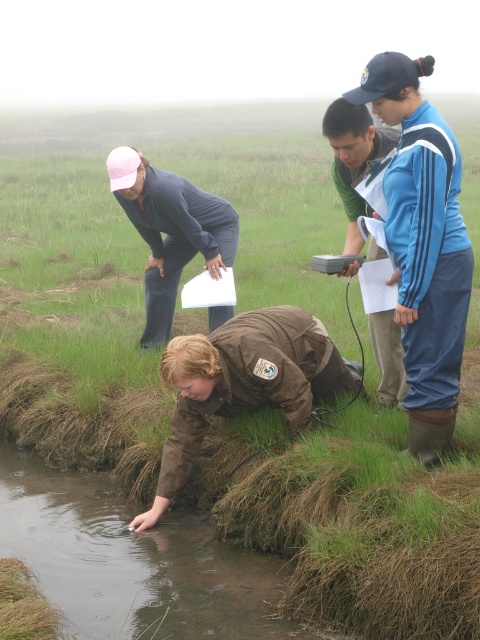
Who is taller, brown suede jacket at lower center or matte pink cap at upper left?

With more height is matte pink cap at upper left.

Is point (248, 314) farther from viewer compared to point (203, 236)?

No.

Which is behind, point (294, 360) or point (164, 202)?

The point (164, 202) is more distant.

The width and height of the screenshot is (480, 640). Find the location of `brown suede jacket at lower center`. brown suede jacket at lower center is located at coordinates (241, 381).

Between matte pink cap at upper left and green fabric jacket at center, which one appears on the left side from the viewer's perspective?

matte pink cap at upper left

Who is more distant from viewer, (164, 227) or (399, 339)?

Positioned behind is point (164, 227).

Looking at this image, measure the distance between matte pink cap at upper left and camera.

matte pink cap at upper left and camera are 5.31 meters apart from each other.

This screenshot has height=640, width=480. Find the location of `matte pink cap at upper left`. matte pink cap at upper left is located at coordinates (170, 230).

Consider the image. Does brown suede jacket at lower center come behind green fabric jacket at center?

Yes, brown suede jacket at lower center is further from the viewer.

Is point (220, 394) positioned in front of point (334, 113)?

No, (220, 394) is further to viewer.

At what (x,y) coordinates should I click in order to perform the action: click on brown suede jacket at lower center. Please return your answer as a coordinate pair (x, y). Looking at the image, I should click on (241, 381).